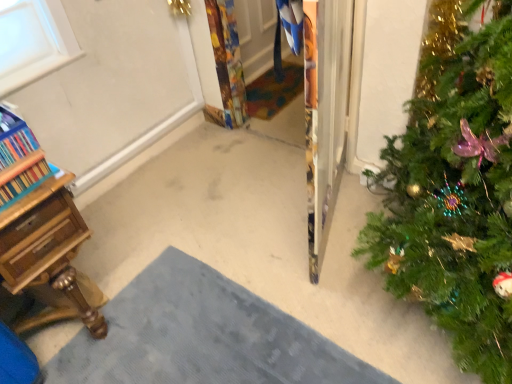
Where is `free space to the back side of gray textured doormat at lower center, arranged as the second doormat when viewed from the top`? free space to the back side of gray textured doormat at lower center, arranged as the second doormat when viewed from the top is located at coordinates (206, 214).